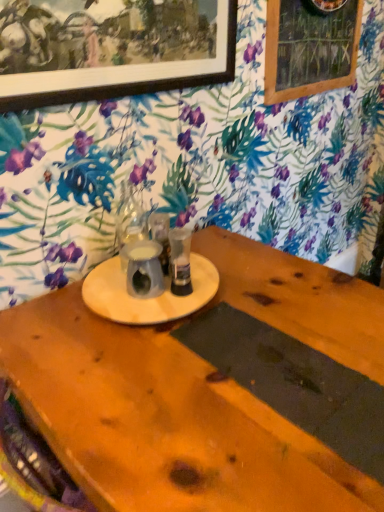
Question: From the image's perspective, does wooden picture frame at upper left appear higher than metallic silver cup at center, acting as the 2th tableware starting from the left?

Choices:
 (A) no
 (B) yes

Answer: (B)

Question: Considering the relative sizes of wooden picture frame at upper left and metallic silver cup at center, the 1th tableware from the right, in the image provided, is wooden picture frame at upper left wider than metallic silver cup at center, the 1th tableware from the right,?

Choices:
 (A) yes
 (B) no

Answer: (B)

Question: Does wooden picture frame at upper left appear on the right side of metallic silver cup at center, the 1th tableware from the right?

Choices:
 (A) no
 (B) yes

Answer: (A)

Question: Are wooden picture frame at upper left and metallic silver cup at center, acting as the 2th tableware starting from the left, located far from each other?

Choices:
 (A) no
 (B) yes

Answer: (A)

Question: Is wooden picture frame at upper left not within metallic silver cup at center, acting as the 2th tableware starting from the left?

Choices:
 (A) no
 (B) yes

Answer: (B)

Question: From the image's perspective, relative to wooden frame at upper right, is translucent glass vase at center, the second tableware from the right, above or below?

Choices:
 (A) above
 (B) below

Answer: (B)

Question: Is translucent glass vase at center, the second tableware from the right, in front of or behind wooden frame at upper right in the image?

Choices:
 (A) front
 (B) behind

Answer: (A)

Question: Is translucent glass vase at center, placed as the 1th tableware when sorted from left to right, taller or shorter than wooden frame at upper right?

Choices:
 (A) short
 (B) tall

Answer: (A)

Question: In terms of width, does translucent glass vase at center, placed as the 1th tableware when sorted from left to right, look wider or thinner when compared to wooden frame at upper right?

Choices:
 (A) wide
 (B) thin

Answer: (A)

Question: From a real-world perspective, relative to translucent glass vase at center, placed as the 1th tableware when sorted from left to right, is wooden picture frame at upper left vertically above or below?

Choices:
 (A) above
 (B) below

Answer: (A)

Question: Is point (14, 10) positioned closer to the camera than point (119, 224)?

Choices:
 (A) closer
 (B) farther

Answer: (A)

Question: Is wooden picture frame at upper left in front of or behind translucent glass vase at center, placed as the 1th tableware when sorted from left to right, in the image?

Choices:
 (A) front
 (B) behind

Answer: (A)

Question: Visually, is wooden picture frame at upper left positioned to the left or to the right of translucent glass vase at center, the second tableware from the right?

Choices:
 (A) left
 (B) right

Answer: (B)

Question: From the image's perspective, is wooden picture frame at upper left positioned above or below dark gray matte placemat at bottom center?

Choices:
 (A) below
 (B) above

Answer: (B)

Question: From their relative heights in the image, would you say wooden picture frame at upper left is taller or shorter than dark gray matte placemat at bottom center?

Choices:
 (A) tall
 (B) short

Answer: (A)